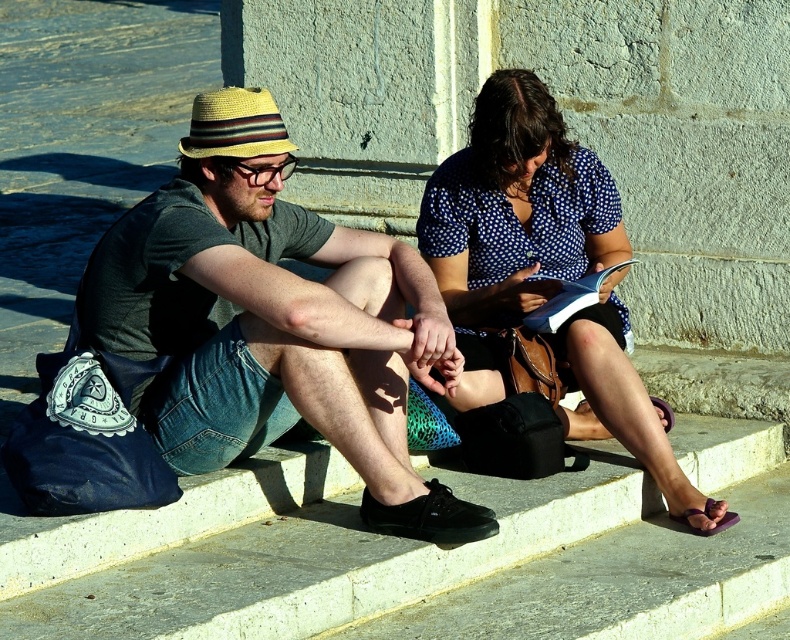
Question: Estimate the real-world distances between objects in this image. Which object is closer to the black canvas shoe at lower center?

Choices:
 (A) blue dotted blouse at upper center
 (B) purple fabric sandal at lower right
 (C) matte black shoes at lower center

Answer: (C)

Question: Does matte black shoes at lower center come behind black canvas shoe at lower center?

Choices:
 (A) no
 (B) yes

Answer: (A)

Question: Estimate the real-world distances between objects in this image. Which object is farther from the purple fabric sandal at lower right?

Choices:
 (A) matte black shoes at lower center
 (B) black canvas shoe at lower center

Answer: (A)

Question: Estimate the real-world distances between objects in this image. Which object is closer to the blue dotted blouse at upper center?

Choices:
 (A) matte black shoes at lower center
 (B) black canvas shoe at lower center

Answer: (A)

Question: Is blue dotted blouse at upper center in front of black canvas shoe at lower center?

Choices:
 (A) yes
 (B) no

Answer: (B)

Question: Considering the relative positions of blue dotted blouse at upper center and black canvas shoe at lower center in the image provided, where is blue dotted blouse at upper center located with respect to black canvas shoe at lower center?

Choices:
 (A) above
 (B) below

Answer: (A)